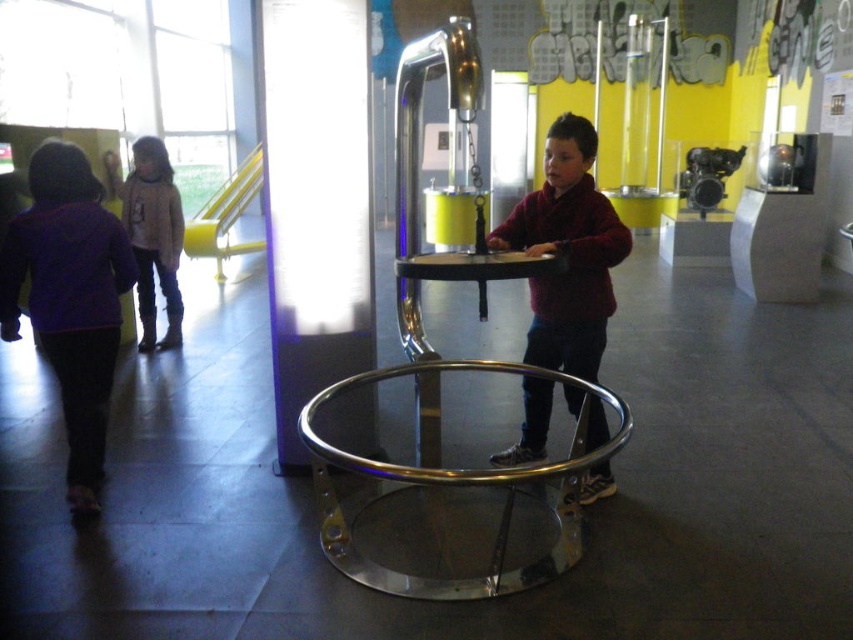
Question: Which point is farther to the camera?

Choices:
 (A) matte gray sweater at left
 (B) purple fleece jacket at left
 (C) polished metal round table at center
 (D) maroon sweater at center

Answer: (A)

Question: Which of the following is the closest to the observer?

Choices:
 (A) polished metal round table at center
 (B) matte gray sweater at left

Answer: (A)

Question: Which point is closer to the camera?

Choices:
 (A) [44, 147]
 (B) [531, 328]
 (C) [567, 483]
 (D) [152, 212]

Answer: (C)

Question: Does polished metal round table at center appear on the right side of matte gray sweater at left?

Choices:
 (A) yes
 (B) no

Answer: (A)

Question: From the image, what is the correct spatial relationship of purple fleece jacket at left in relation to polished metal round table at center?

Choices:
 (A) right
 (B) left

Answer: (B)

Question: Can you confirm if purple fleece jacket at left is positioned above maroon sweater at center?

Choices:
 (A) no
 (B) yes

Answer: (B)